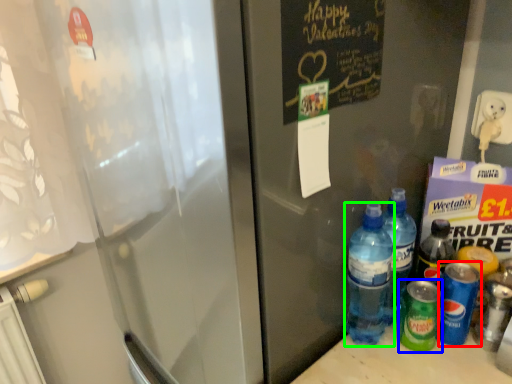
Question: Considering the real-world distances, which object is farthest from bottle (highlighted by a red box)? bottle (highlighted by a blue box) or bottle (highlighted by a green box)?

Choices:
 (A) bottle
 (B) bottle

Answer: (B)